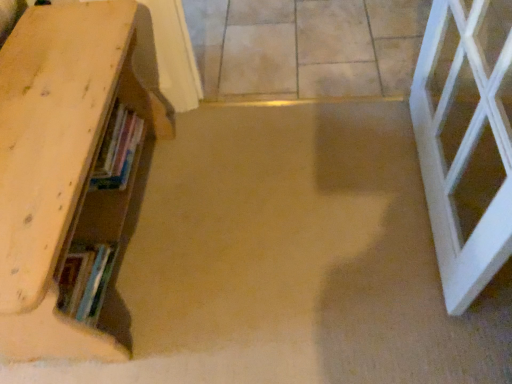
Question: Is hardcover books at left smaller than beige tile floor at center?

Choices:
 (A) yes
 (B) no

Answer: (A)

Question: Considering the relative sizes of hardcover books at left and beige tile floor at center in the image provided, is hardcover books at left shorter than beige tile floor at center?

Choices:
 (A) no
 (B) yes

Answer: (A)

Question: Can you confirm if hardcover books at left is wider than beige tile floor at center?

Choices:
 (A) no
 (B) yes

Answer: (A)

Question: Is hardcover books at left directly adjacent to beige tile floor at center?

Choices:
 (A) yes
 (B) no

Answer: (B)

Question: From a real-world perspective, is hardcover books at left physically above beige tile floor at center?

Choices:
 (A) yes
 (B) no

Answer: (A)

Question: Would you say hardcover books at left contains beige tile floor at center?

Choices:
 (A) no
 (B) yes

Answer: (A)

Question: Does beige tile floor at center appear on the left side of hardcover books at left?

Choices:
 (A) yes
 (B) no

Answer: (B)

Question: Is beige tile floor at center positioned beyond the bounds of hardcover books at left?

Choices:
 (A) no
 (B) yes

Answer: (B)

Question: Does beige tile floor at center have a greater width compared to hardcover books at left?

Choices:
 (A) no
 (B) yes

Answer: (B)

Question: Is beige tile floor at center turned away from hardcover books at left?

Choices:
 (A) no
 (B) yes

Answer: (A)

Question: Is beige tile floor at center far from hardcover books at left?

Choices:
 (A) no
 (B) yes

Answer: (A)

Question: From a real-world perspective, is beige tile floor at center positioned under hardcover books at left based on gravity?

Choices:
 (A) no
 (B) yes

Answer: (B)

Question: Can you confirm if beige tile floor at center is thinner than wooden bookshelf at left?

Choices:
 (A) yes
 (B) no

Answer: (B)